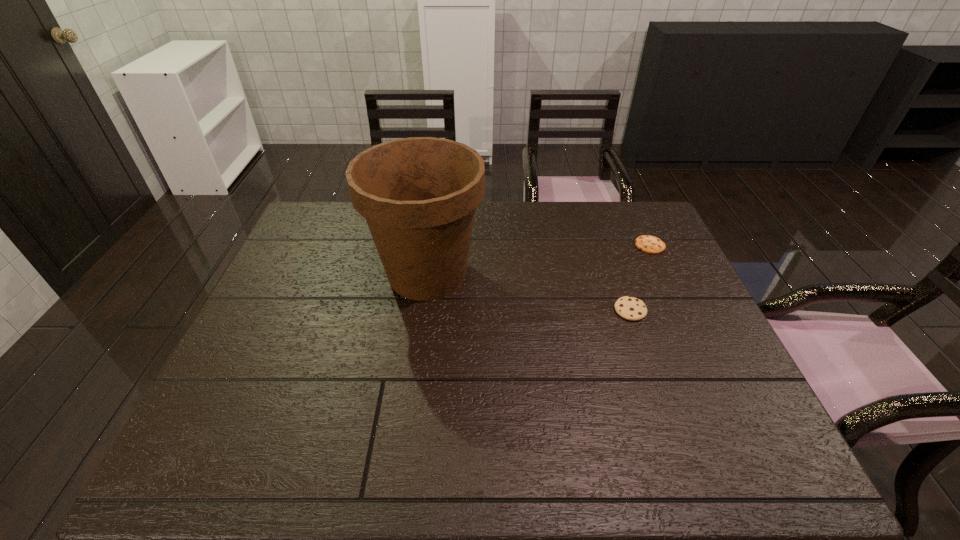
Where is `vacant space that satisfies the following two spatial constraints: 1. on the front side of the left cookie; 2. on the right side of the tallest object`? vacant space that satisfies the following two spatial constraints: 1. on the front side of the left cookie; 2. on the right side of the tallest object is located at coordinates (422, 310).

This screenshot has width=960, height=540. I want to click on free space that satisfies the following two spatial constraints: 1. on the back side of the shortest object; 2. on the left side of the leftmost object, so click(431, 246).